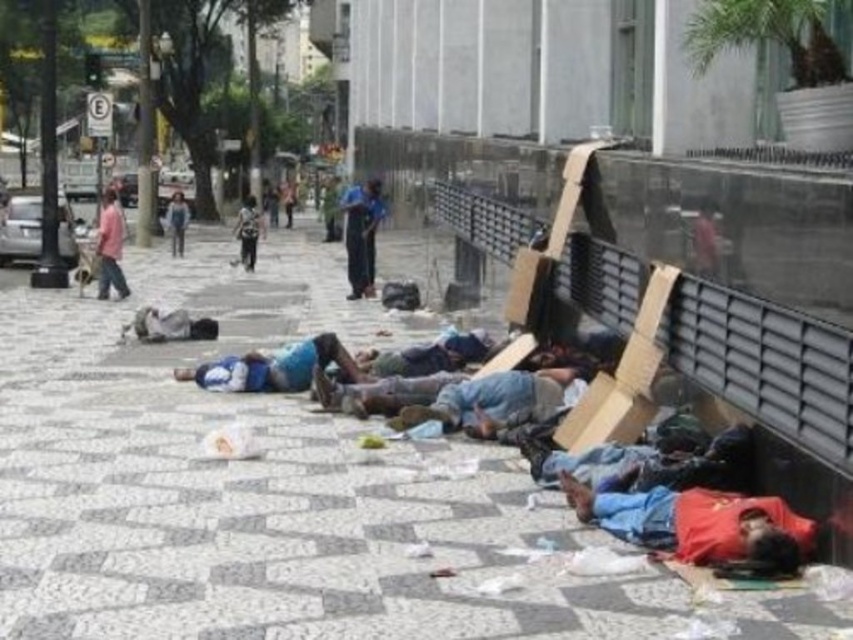
Describe the element at coordinates (273, 368) in the screenshot. I see `blue fabric shirt at center` at that location.

Which is above, blue fabric shirt at center or denim pants at center?

denim pants at center is higher up.

Is point (204, 364) closer to camera compared to point (184, 225)?

That is True.

This screenshot has width=853, height=640. I want to click on blue fabric shirt at center, so click(x=273, y=368).

Is point (770, 540) closer to camera compared to point (306, 353)?

Yes, point (770, 540) is closer to viewer.

Does red fabric shirt at lower right appear on the left side of blue fabric shirt at center?

No, red fabric shirt at lower right is not to the left of blue fabric shirt at center.

What do you see at coordinates (699, 524) in the screenshot?
I see `red fabric shirt at lower right` at bounding box center [699, 524].

Where is `red fabric shirt at lower right`? This screenshot has height=640, width=853. red fabric shirt at lower right is located at coordinates (699, 524).

Can you confirm if matte pink shirt at left is bigger than light brown leather jacket at center?

Incorrect, matte pink shirt at left is not larger than light brown leather jacket at center.

What do you see at coordinates (109, 248) in the screenshot? The height and width of the screenshot is (640, 853). I see `matte pink shirt at left` at bounding box center [109, 248].

Does point (102, 209) come behind point (247, 260)?

No, (102, 209) is closer to viewer.

You are a GUI agent. You are given a task and a screenshot of the screen. Output one action in this format:
    pyautogui.click(x=<x>, y=<y>)
    Task: Click on the matte pink shirt at left
    The image size is (853, 640).
    Given the screenshot: What is the action you would take?
    pyautogui.click(x=109, y=248)